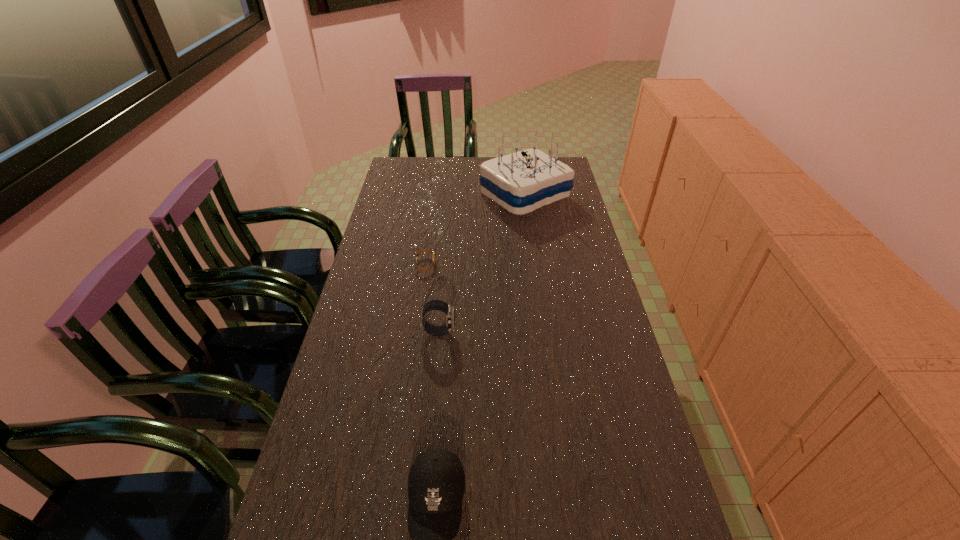
The image size is (960, 540). I want to click on the second closest object relative to the baseball cap, so click(425, 250).

Image resolution: width=960 pixels, height=540 pixels. I want to click on vacant space that satisfies the following two spatial constraints: 1. on the front side of the farthest object; 2. on the face of the nearer watch, so click(544, 332).